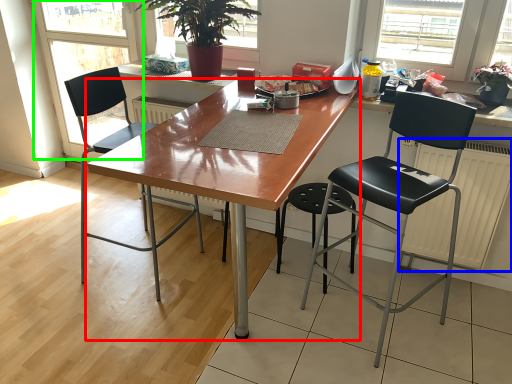
Question: Which object is the farthest from desk (highlighted by a red box)? Choose among these: radiator (highlighted by a blue box) or screen door (highlighted by a green box).

Choices:
 (A) radiator
 (B) screen door

Answer: (B)